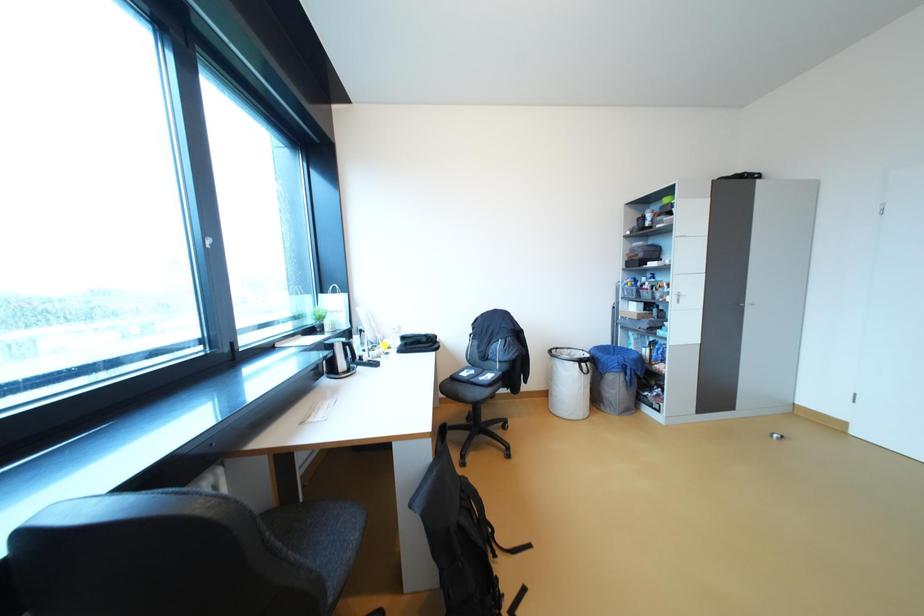
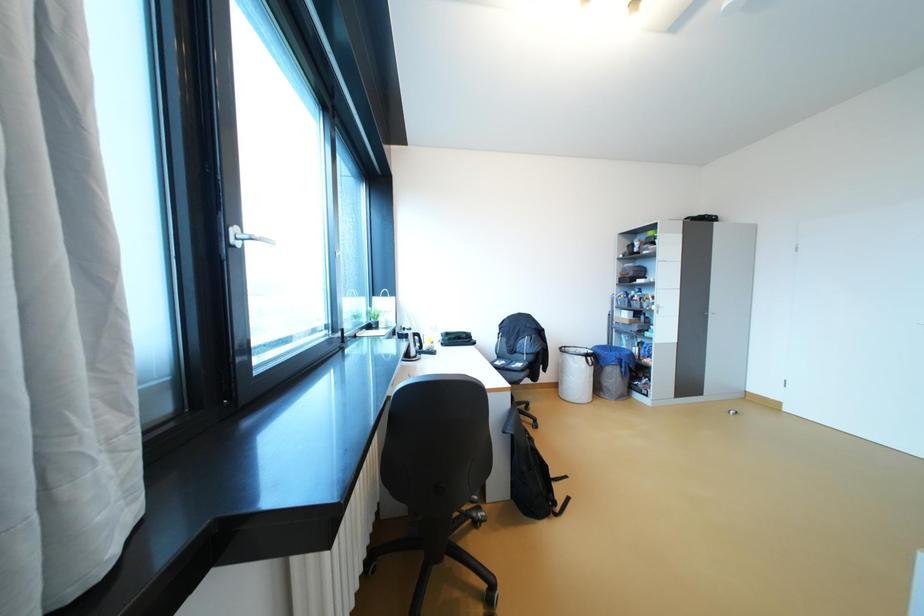
In a continuous first-person perspective shot, in which direction is the camera moving?

The movement direction of the cameraman is left, backward.